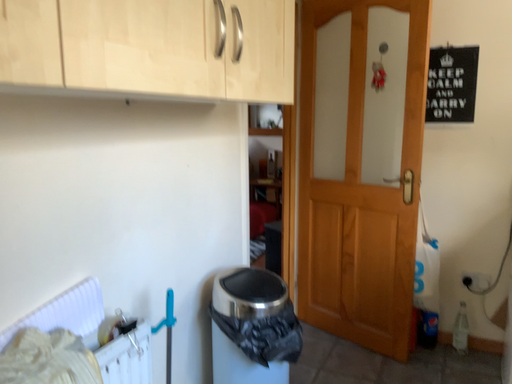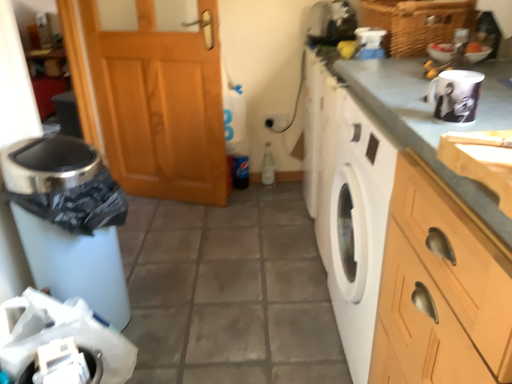
Question: Which way did the camera rotate in the video?

Choices:
 (A) rotated right
 (B) rotated left

Answer: (A)